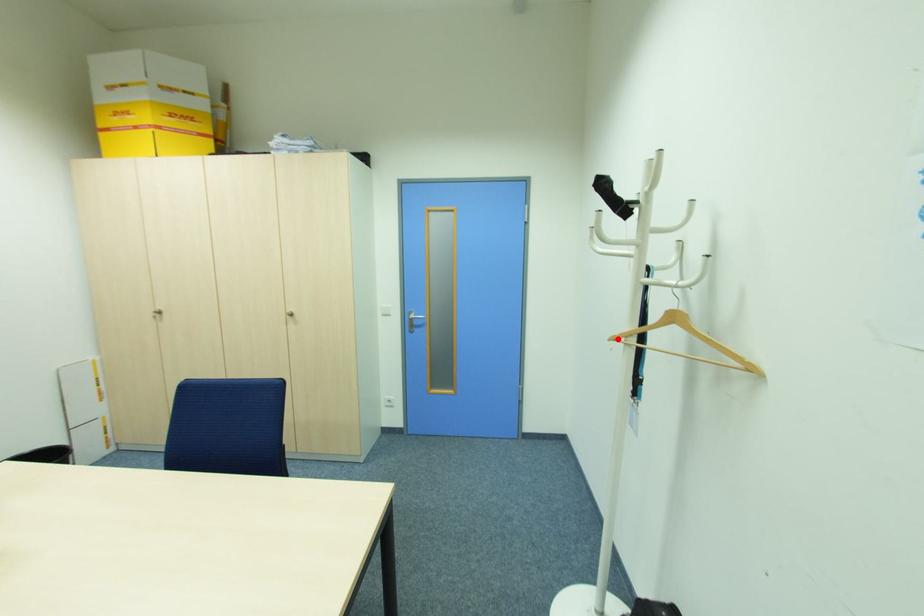
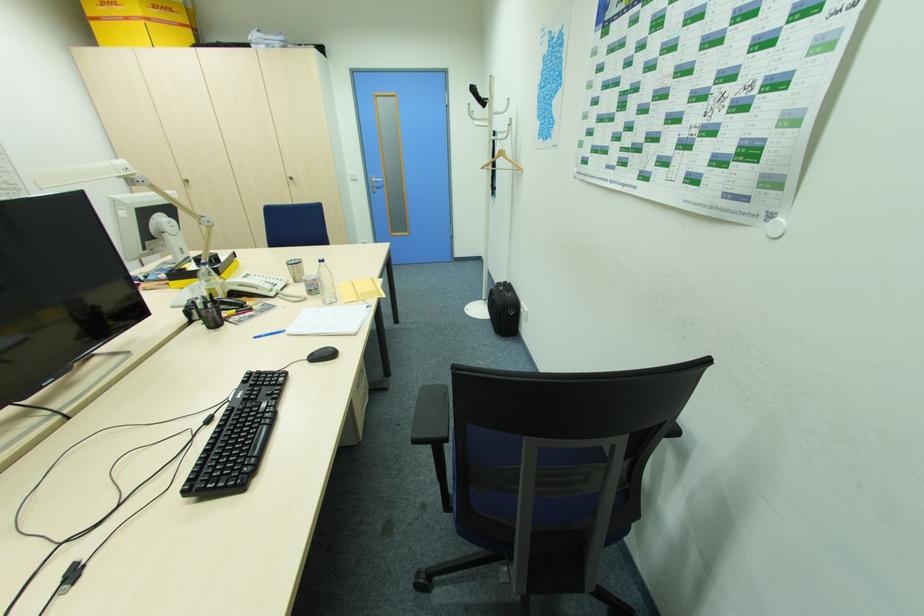
Locate, in the second image, the point that corresponds to the highlighted location in the first image.

(485, 168)